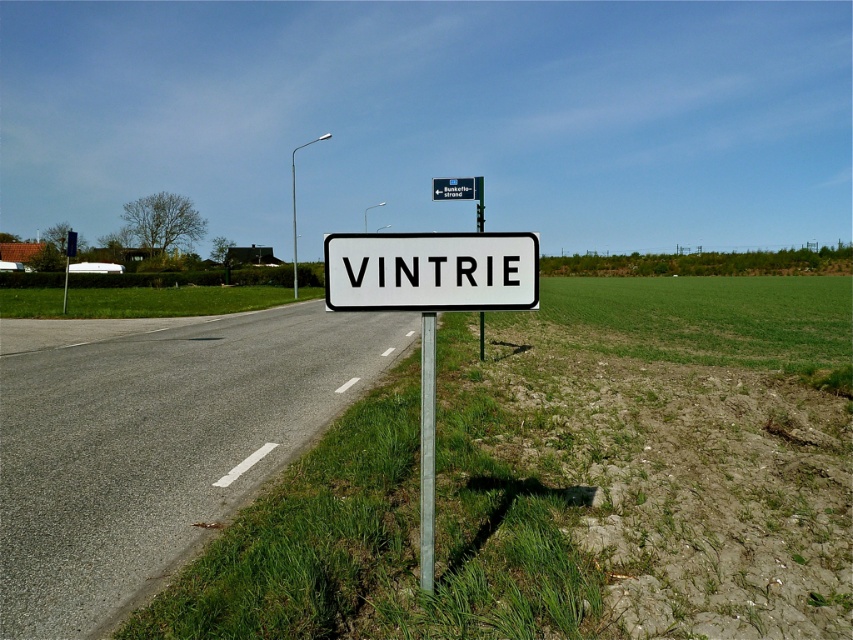
You are driving along the road and see the metallic pole at center and the green plastic sign at center. Which object is closer to you?

The metallic pole at center is closer to you because it is in front of the green plastic sign at center.

You are driving a car and want to know if the gray asphalt road at center is visible below the green plastic sign at center. Based on the scene description, can you confirm this?

The gray asphalt road at center is positioned under green plastic sign at center, so yes, the road is visible below the sign.

You are a delivery driver who needs to ensure your truck can pass under the white plastic sign at center while driving on the gray asphalt road at center. Based on the scene, can you determine if the truck will clear the sign without hitting it?

The gray asphalt road at center has a greater height compared to white plastic sign at center, meaning the road is elevated higher than the sign. Therefore, the truck should be able to pass under the sign safely without any collision.